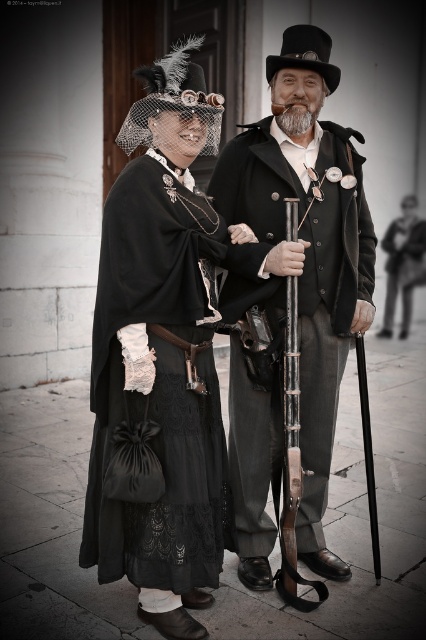
Question: Which point is farther from the camera taking this photo?

Choices:
 (A) (160, 545)
 (B) (287, 35)

Answer: (B)

Question: Does matte black coat at center appear on the right side of black lace dress at left?

Choices:
 (A) yes
 (B) no

Answer: (A)

Question: From the image, what is the correct spatial relationship of matte black coat at center in relation to black lace dress at left?

Choices:
 (A) above
 (B) below

Answer: (A)

Question: Which point appears closest to the camera in this image?

Choices:
 (A) pos(313,288)
 (B) pos(149,348)

Answer: (B)

Question: Can you confirm if matte black coat at center is wider than black lace dress at left?

Choices:
 (A) no
 (B) yes

Answer: (B)

Question: Which point is closer to the camera?

Choices:
 (A) black lace dress at left
 (B) matte black coat at center

Answer: (A)